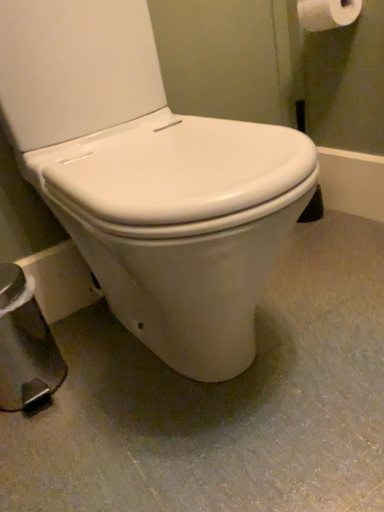
Identify the location of white smooth toilet at center. The width and height of the screenshot is (384, 512). [x=223, y=402].

This screenshot has width=384, height=512. Identify the location of white matte toilet paper at upper right. (327, 14).

Measure the distance between white glossy toilet at center and camera.

The distance of white glossy toilet at center from camera is 19.31 inches.

Describe the element at coordinates (149, 179) in the screenshot. I see `white glossy toilet at center` at that location.

The height and width of the screenshot is (512, 384). I want to click on white smooth toilet at center, so click(x=223, y=402).

In terms of width, does white glossy toilet at center look wider or thinner when compared to white matte toilet paper at upper right?

Clearly, white glossy toilet at center has more width compared to white matte toilet paper at upper right.

Measure the distance between white glossy toilet at center and white matte toilet paper at upper right.

They are 27.22 inches apart.

Is white glossy toilet at center positioned far away from white matte toilet paper at upper right?

No, there isn't a large distance between white glossy toilet at center and white matte toilet paper at upper right.

Looking at this image, from a real-world perspective, is white glossy toilet at center positioned over white matte toilet paper at upper right based on gravity?

Incorrect, from a real-world perspective, white glossy toilet at center is lower than white matte toilet paper at upper right.

Is white matte toilet paper at upper right further to camera compared to white glossy toilet at center?

Yes, white matte toilet paper at upper right is further from the viewer.

Is point (324, 27) closer to camera compared to point (174, 174)?

No, (324, 27) is behind (174, 174).

Image resolution: width=384 pixels, height=512 pixels. In the image, there is a white glossy toilet at center. Find the location of `toilet paper above it (from the image's perspective)`. toilet paper above it (from the image's perspective) is located at coordinates (327, 14).

Considering the relative sizes of white matte toilet paper at upper right and white smooth toilet at center in the image provided, is white matte toilet paper at upper right thinner than white smooth toilet at center?

Yes, white matte toilet paper at upper right is thinner than white smooth toilet at center.

Based on their positions, is white matte toilet paper at upper right located to the left or right of white smooth toilet at center?

In the image, white matte toilet paper at upper right appears on the right side of white smooth toilet at center.

Does white matte toilet paper at upper right have a greater height compared to white smooth toilet at center?

Yes, white matte toilet paper at upper right is taller than white smooth toilet at center.

How much distance is there between white matte toilet paper at upper right and white smooth toilet at center?

34.51 inches.

Which object is further away from the camera taking this photo, white smooth toilet at center or white matte toilet paper at upper right?

white matte toilet paper at upper right.

Is white smooth toilet at center positioned with its back to white matte toilet paper at upper right?

No, white smooth toilet at center is not facing the opposite direction of white matte toilet paper at upper right.

Between white smooth toilet at center and white matte toilet paper at upper right, which one appears on the right side from the viewer's perspective?

white matte toilet paper at upper right is more to the right.

From a real-world perspective, which object rests below the other?

white smooth toilet at center, from a real-world perspective.

Who is taller, white glossy toilet at center or white smooth toilet at center?

With more height is white glossy toilet at center.

Is white glossy toilet at center aimed at white smooth toilet at center?

No.

Which object is wider, white glossy toilet at center or white smooth toilet at center?

With larger width is white smooth toilet at center.

In the scene shown: Does white smooth toilet at center contain white glossy toilet at center?

No, white glossy toilet at center is not a part of white smooth toilet at center.

Identify the location of toilet that appears on the left of white smooth toilet at center. This screenshot has height=512, width=384. [149, 179].

From the image's perspective, does white smooth toilet at center appear higher than white glossy toilet at center?

Incorrect, from the image's perspective, white smooth toilet at center is lower than white glossy toilet at center.

Which is more to the left, white smooth toilet at center or white glossy toilet at center?

Positioned to the left is white glossy toilet at center.

Identify the location of toilet below the white matte toilet paper at upper right (from the image's perspective). (149, 179).

Where is `toilet in front of the white matte toilet paper at upper right`? Image resolution: width=384 pixels, height=512 pixels. toilet in front of the white matte toilet paper at upper right is located at coordinates (149, 179).

Considering their positions, is white smooth toilet at center positioned closer to white glossy toilet at center than white matte toilet paper at upper right?

Based on the image, white smooth toilet at center appears to be nearer to white glossy toilet at center.

Looking at the image, which one is located closer to white matte toilet paper at upper right, white smooth toilet at center or white glossy toilet at center?

white glossy toilet at center is positioned closer to the anchor white matte toilet paper at upper right.

Considering their positions, is white glossy toilet at center positioned closer to white matte toilet paper at upper right than white smooth toilet at center?

white glossy toilet at center lies closer to white matte toilet paper at upper right than the other object.

Which object lies further to the anchor point white smooth toilet at center, white matte toilet paper at upper right or white glossy toilet at center?

Based on the image, white matte toilet paper at upper right appears to be further to white smooth toilet at center.

Based on their spatial positions, is white matte toilet paper at upper right or white smooth toilet at center closer to white glossy toilet at center?

white smooth toilet at center.

Looking at the image, which one is located further to white smooth toilet at center, white glossy toilet at center or white matte toilet paper at upper right?

The object further to white smooth toilet at center is white matte toilet paper at upper right.

Image resolution: width=384 pixels, height=512 pixels. I want to click on toilet between white matte toilet paper at upper right and white smooth toilet at center vertically, so click(149, 179).